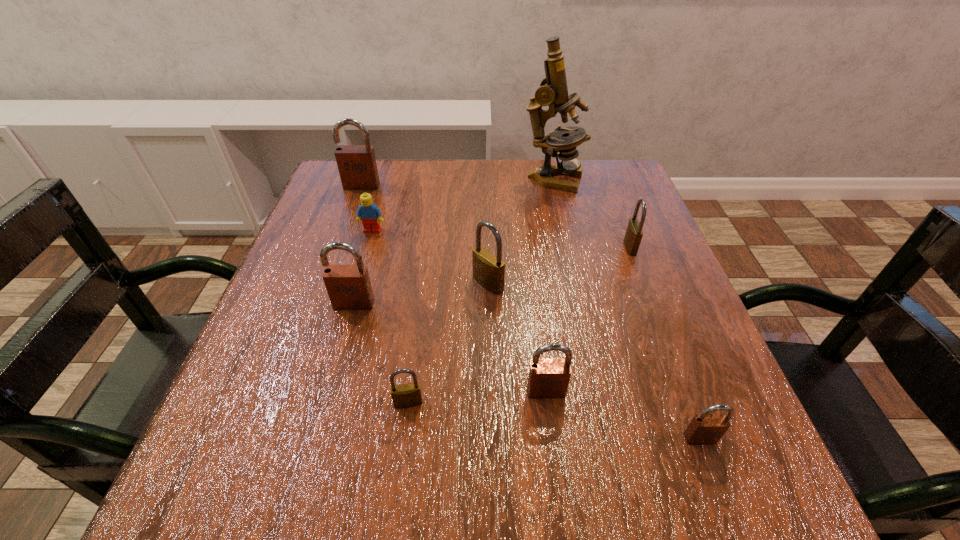
I want to click on padlock identified as the closest to the blue Lego, so click(357, 167).

Locate which brown padlock is the third closest to the blue Lego. Please provide its 2D coordinates. Your answer should be formatted as a tuple, i.e. [(x, y)], where the tuple contains the x and y coordinates of a point satisfying the conditions above.

[(548, 378)]

Find the location of a particular element. brown padlock that is the third closest to the fifth nearest padlock is located at coordinates (704, 428).

Identify the location of the closest brass padlock to the tallest object. Image resolution: width=960 pixels, height=540 pixels. (633, 236).

Locate which brass padlock is the closest to the fourth farthest object. Please provide its 2D coordinates. Your answer should be formatted as a tuple, i.e. [(x, y)], where the tuple contains the x and y coordinates of a point satisfying the conditions above.

[(488, 270)]

Find the location of a particular element. This screenshot has height=540, width=960. free space that satisfies the following two spatial constraints: 1. on the face of the Lego; 2. on the right side of the second nearest brass padlock is located at coordinates point(357,284).

This screenshot has width=960, height=540. Find the location of `blank space that satisfies the following two spatial constraints: 1. on the front-facing side of the nearest brass padlock; 2. on the right side of the tallest padlock`. blank space that satisfies the following two spatial constraints: 1. on the front-facing side of the nearest brass padlock; 2. on the right side of the tallest padlock is located at coordinates click(285, 403).